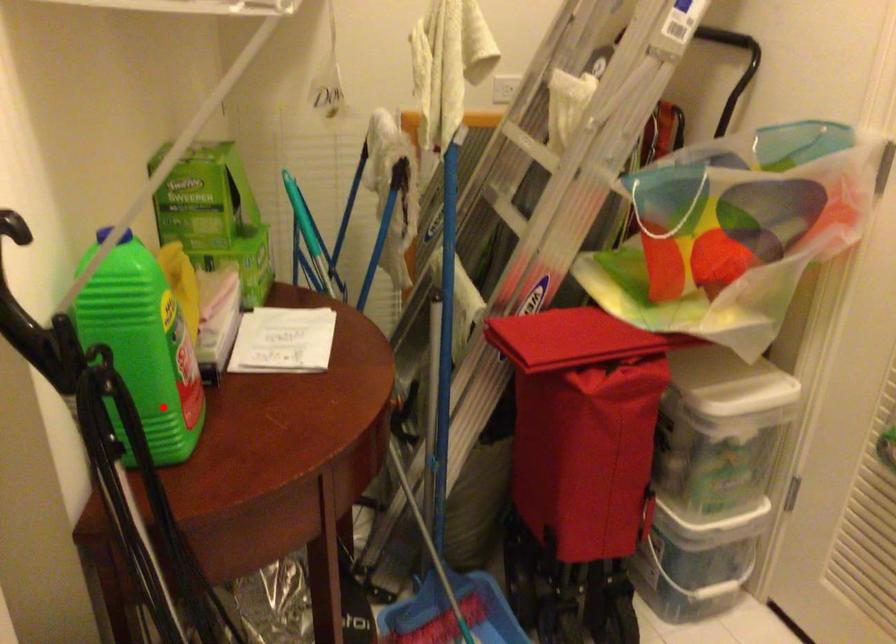
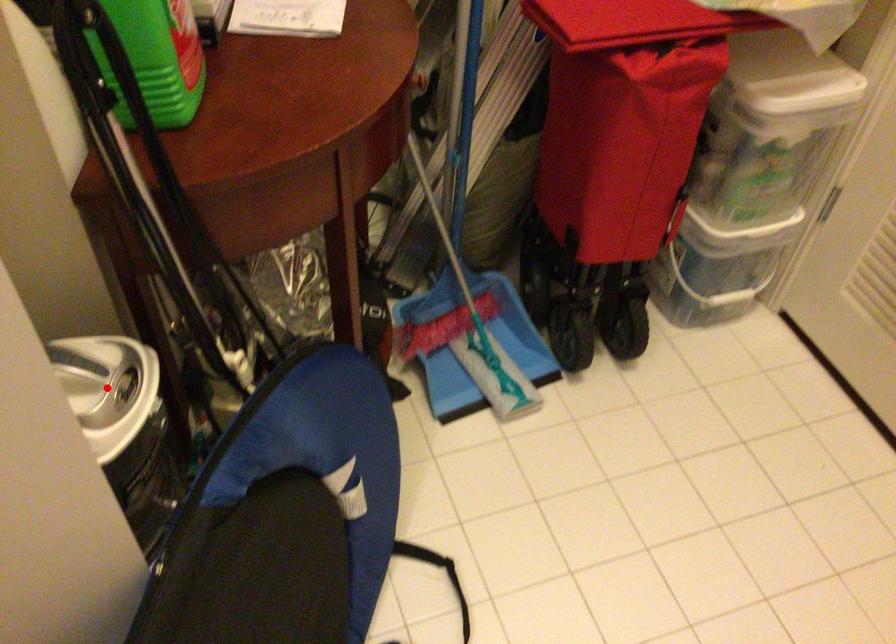
Consider the image. I am providing you with two images of the same scene from different viewpoints. A red point is marked on the first image and another point is marked on the second image. Is the red point in image1 aligned with the point shown in image2?

No